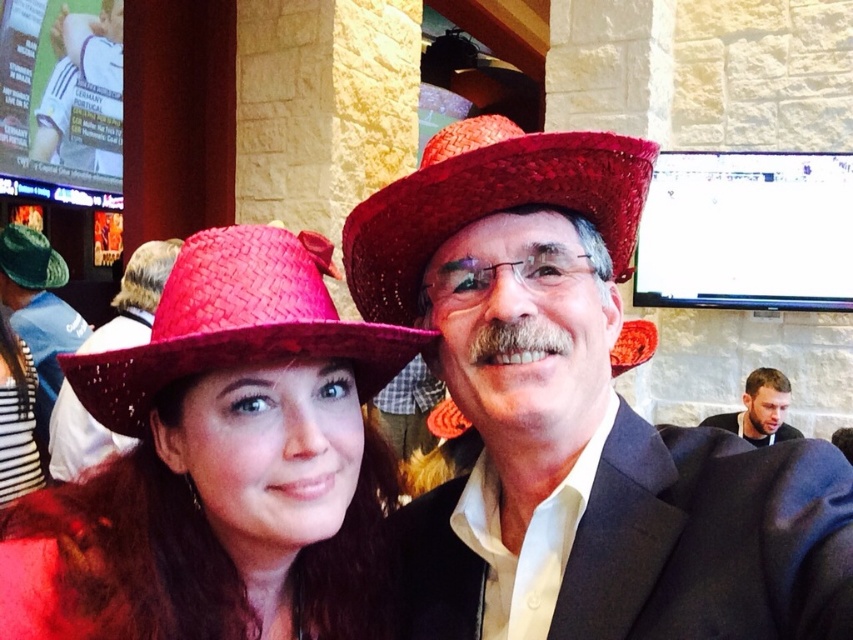
You are standing in the bar and want to place a small decoration between the two points, point (103, 634) and point (190, 314). Which point should you place it closer to so that it appears larger to the viewer?

The decoration should be placed closer to point (103, 634) because it is closer to the viewer, making the decoration appear larger.

You are standing in the bar and want to place a small decorative item on the table between the two points labeled point (498, 323) and point (769, 432). Which point should you place it closer to so that it appears larger in the photo taken from your current position?

You should place the item closer to point (498, 323) because it is closer to the viewer, making the item appear larger in the photo compared to placing it near point (769, 432).